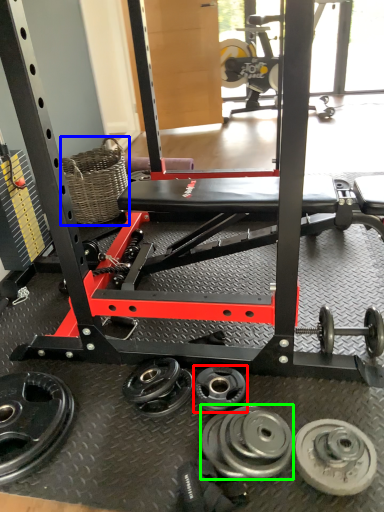
Question: Which object is positioned closest to wheel (highlighted by a red box)? Select from basket (highlighted by a blue box) and wheel (highlighted by a green box).

Choices:
 (A) basket
 (B) wheel

Answer: (B)